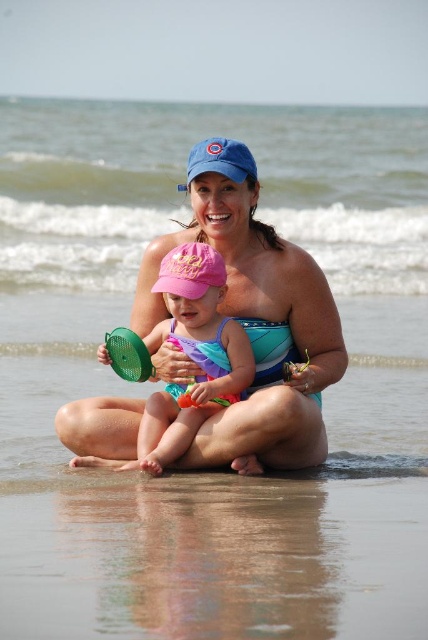
Question: Is matte blue swim cap at center thinner than pink fabric swimsuit at center?

Choices:
 (A) yes
 (B) no

Answer: (A)

Question: Considering the relative positions of matte blue swim cap at center and pink fabric swimsuit at center in the image provided, where is matte blue swim cap at center located with respect to pink fabric swimsuit at center?

Choices:
 (A) left
 (B) right

Answer: (B)

Question: Does matte blue swim cap at center appear over pink fabric swimsuit at center?

Choices:
 (A) yes
 (B) no

Answer: (A)

Question: Which point is farther to the camera?

Choices:
 (A) matte blue swim cap at center
 (B) pink fabric swimsuit at center

Answer: (A)